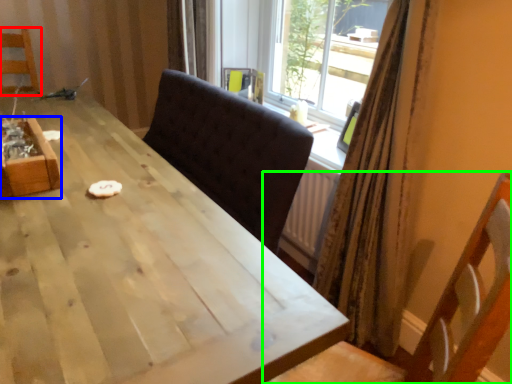
Question: Which object is the farthest from chair (highlighted by a red box)? Choose among these: crate (highlighted by a blue box) or chair (highlighted by a green box).

Choices:
 (A) crate
 (B) chair

Answer: (B)